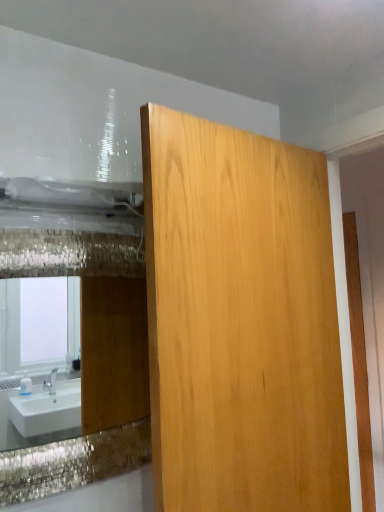
The width and height of the screenshot is (384, 512). Identify the location of shiny glass mirror at upper left. (91, 366).

Measure the distance between point (114,418) and camera.

A distance of 4.22 feet exists between point (114,418) and camera.

Measure the distance between shiny glass mirror at upper left and camera.

shiny glass mirror at upper left is 7.57 feet from camera.

Describe the element at coordinates (91, 366) in the screenshot. I see `shiny glass mirror at upper left` at that location.

What do you see at coordinates (240, 321) in the screenshot?
I see `light wood panel at center` at bounding box center [240, 321].

Where is `light wood panel at center`? This screenshot has height=512, width=384. light wood panel at center is located at coordinates (240, 321).

Locate an element on the screen. The image size is (384, 512). shiny glass mirror at upper left is located at coordinates (91, 366).

Between shiny glass mirror at upper left and light wood panel at center, which one appears on the right side from the viewer's perspective?

Positioned to the right is light wood panel at center.

Considering the positions of objects shiny glass mirror at upper left and light wood panel at center in the image provided, who is in front, shiny glass mirror at upper left or light wood panel at center?

light wood panel at center is in front.

Does point (94, 374) come closer to viewer compared to point (160, 506)?

No, (94, 374) is behind (160, 506).

From the image's perspective, is shiny glass mirror at upper left located above or below light wood panel at center?

Result: shiny glass mirror at upper left is below light wood panel at center.

From a real-world perspective, is shiny glass mirror at upper left above or below light wood panel at center?

shiny glass mirror at upper left is below light wood panel at center.

Does shiny glass mirror at upper left have a greater width compared to light wood panel at center?

No.

In terms of height, does shiny glass mirror at upper left look taller or shorter compared to light wood panel at center?

In the image, shiny glass mirror at upper left appears to be shorter than light wood panel at center.

In the scene shown: Considering the relative sizes of shiny glass mirror at upper left and light wood panel at center in the image provided, is shiny glass mirror at upper left smaller than light wood panel at center?

Yes, shiny glass mirror at upper left is smaller than light wood panel at center.

Looking at this image, is shiny glass mirror at upper left situated inside light wood panel at center or outside?

shiny glass mirror at upper left is not enclosed by light wood panel at center.

Is shiny glass mirror at upper left next to light wood panel at center?

No, shiny glass mirror at upper left is not in contact with light wood panel at center.

Is light wood panel at center at the back of shiny glass mirror at upper left?

That's not correct — shiny glass mirror at upper left is not looking away from light wood panel at center.

This screenshot has width=384, height=512. I want to click on bathroom cabinet above the shiny glass mirror at upper left (from a real-world perspective), so click(x=240, y=321).

Which object is positioned more to the right, light wood panel at center or shiny glass mirror at upper left?

From the viewer's perspective, light wood panel at center appears more on the right side.

Which object is closer to the camera, light wood panel at center or shiny glass mirror at upper left?

light wood panel at center is closer to the camera.

Is point (185, 362) farther from viewer compared to point (145, 340)?

That is False.

From the image's perspective, between light wood panel at center and shiny glass mirror at upper left, who is located below?

shiny glass mirror at upper left is shown below in the image.

From a real-world perspective, is light wood panel at center physically above shiny glass mirror at upper left?

Indeed, from a real-world perspective, light wood panel at center stands above shiny glass mirror at upper left.

Is light wood panel at center wider or thinner than shiny glass mirror at upper left?

Considering their sizes, light wood panel at center looks broader than shiny glass mirror at upper left.

Which of these two, light wood panel at center or shiny glass mirror at upper left, stands taller?

light wood panel at center.

Is light wood panel at center bigger or smaller than shiny glass mirror at upper left?

light wood panel at center is bigger than shiny glass mirror at upper left.

Is light wood panel at center positioned beyond the bounds of shiny glass mirror at upper left?

Indeed, light wood panel at center is completely outside shiny glass mirror at upper left.

Is there a large distance between light wood panel at center and shiny glass mirror at upper left?

Absolutely, light wood panel at center is distant from shiny glass mirror at upper left.

Is light wood panel at center positioned with its back to shiny glass mirror at upper left?

That's right, light wood panel at center is facing away from shiny glass mirror at upper left.

What's the angular difference between light wood panel at center and shiny glass mirror at upper left's facing directions?

The facing directions of light wood panel at center and shiny glass mirror at upper left are 7.85 degrees apart.

You are a GUI agent. You are given a task and a screenshot of the screen. Output one action in this format:
    pyautogui.click(x=<x>, y=<y>)
    Task: Click on the bathroom cabinet on the right of shiny glass mirror at upper left
    The width and height of the screenshot is (384, 512).
    Given the screenshot: What is the action you would take?
    pyautogui.click(x=240, y=321)

Where is `bathroom cabinet that is above the shiny glass mirror at upper left (from a real-world perspective)`? The height and width of the screenshot is (512, 384). bathroom cabinet that is above the shiny glass mirror at upper left (from a real-world perspective) is located at coordinates (240, 321).

The height and width of the screenshot is (512, 384). I want to click on mirror on the left of light wood panel at center, so click(91, 366).